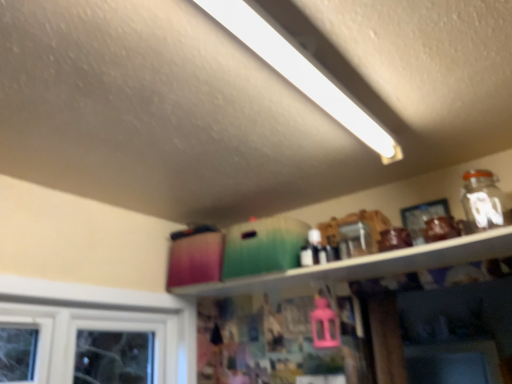
Question: Does white fluorescent tube at upper center come in front of matte green container at upper center?

Choices:
 (A) yes
 (B) no

Answer: (A)

Question: Is white fluorescent tube at upper center smaller than matte green container at upper center?

Choices:
 (A) no
 (B) yes

Answer: (A)

Question: Is white fluorescent tube at upper center outside of matte green container at upper center?

Choices:
 (A) no
 (B) yes

Answer: (B)

Question: Is there a large distance between white fluorescent tube at upper center and matte green container at upper center?

Choices:
 (A) no
 (B) yes

Answer: (A)

Question: From a real-world perspective, is white fluorescent tube at upper center beneath matte green container at upper center?

Choices:
 (A) yes
 (B) no

Answer: (B)

Question: Is white fluorescent tube at upper center positioned behind matte green container at upper center?

Choices:
 (A) no
 (B) yes

Answer: (A)

Question: From a real-world perspective, is matte green container at upper center located higher than white fluorescent tube at upper center?

Choices:
 (A) no
 (B) yes

Answer: (A)

Question: Considering the relative sizes of matte green container at upper center and white fluorescent tube at upper center in the image provided, is matte green container at upper center shorter than white fluorescent tube at upper center?

Choices:
 (A) no
 (B) yes

Answer: (B)

Question: Is matte green container at upper center outside white fluorescent tube at upper center?

Choices:
 (A) yes
 (B) no

Answer: (A)

Question: Considering the relative sizes of matte green container at upper center and white fluorescent tube at upper center in the image provided, is matte green container at upper center thinner than white fluorescent tube at upper center?

Choices:
 (A) no
 (B) yes

Answer: (B)

Question: Considering the relative sizes of matte green container at upper center and white fluorescent tube at upper center in the image provided, is matte green container at upper center smaller than white fluorescent tube at upper center?

Choices:
 (A) yes
 (B) no

Answer: (A)

Question: Is matte green container at upper center to the right of white fluorescent tube at upper center from the viewer's perspective?

Choices:
 (A) no
 (B) yes

Answer: (B)

Question: From a real-world perspective, relative to matte green container at upper center, is white fluorescent tube at upper center vertically above or below?

Choices:
 (A) above
 (B) below

Answer: (A)